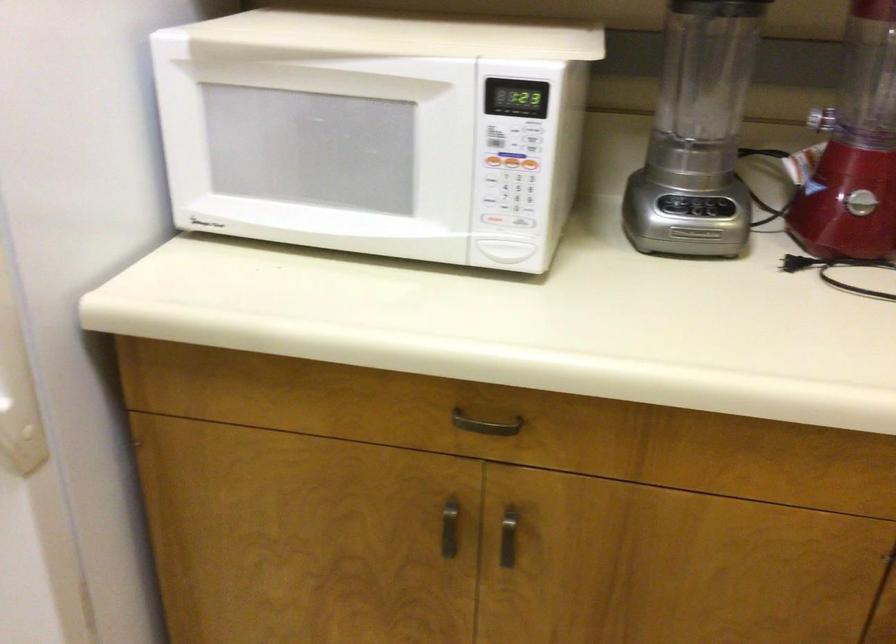
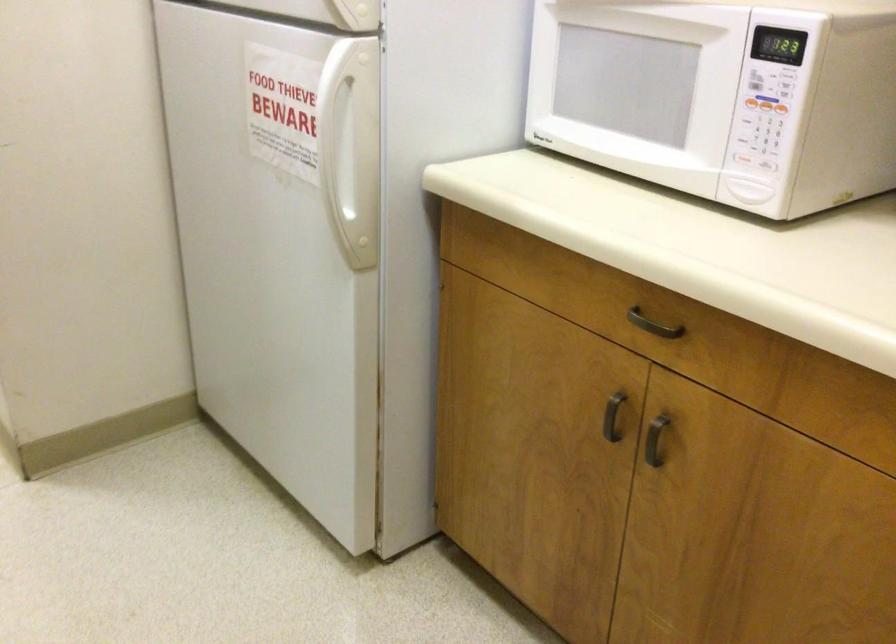
The point at (514,162) is marked in the first image. Where is the corresponding point in the second image?

(765, 104)